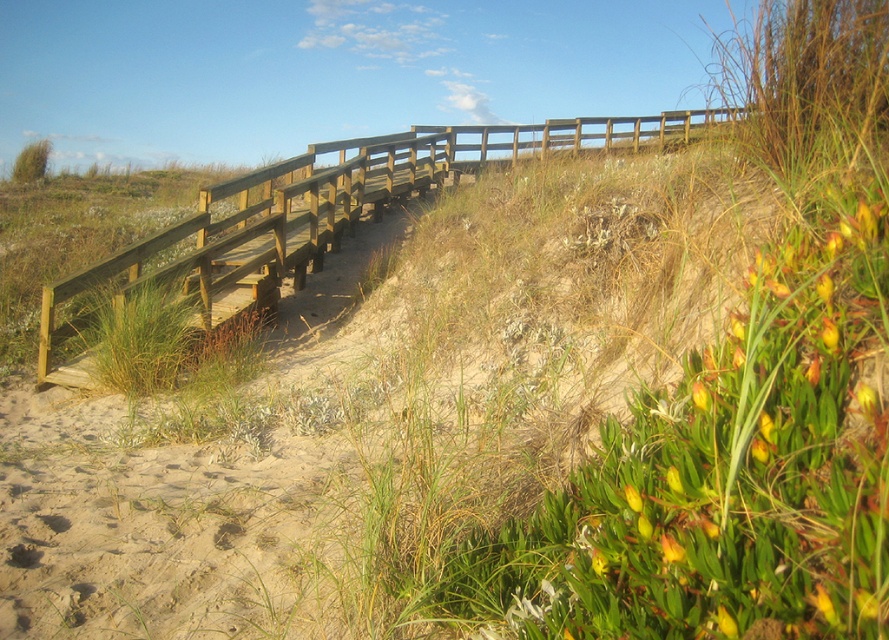
Question: Can you confirm if wooden rail at upper center is positioned below yellow matte flower at lower right?

Choices:
 (A) yes
 (B) no

Answer: (B)

Question: Can you confirm if wooden rail at upper center is positioned to the right of yellow matte flower at lower right?

Choices:
 (A) no
 (B) yes

Answer: (B)

Question: Which point is farther from the camera taking this photo?

Choices:
 (A) [x=675, y=554]
 (B) [x=578, y=124]

Answer: (B)

Question: Can you confirm if wooden rail at upper center is positioned to the right of yellow matte flower at lower right?

Choices:
 (A) yes
 (B) no

Answer: (A)

Question: Among these points, which one is nearest to the camera?

Choices:
 (A) (661, 545)
 (B) (381, 195)

Answer: (A)